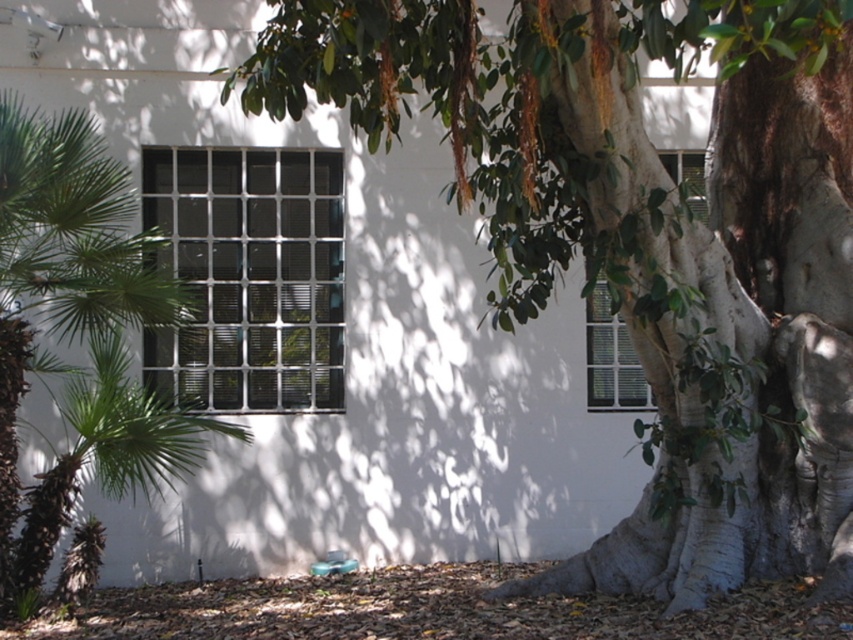
Is clear glass window at center wider than white grid glass window at right?

Correct, the width of clear glass window at center exceeds that of white grid glass window at right.

Between point (173, 209) and point (698, 163), which one is positioned in front?

Point (173, 209)

This screenshot has height=640, width=853. In order to click on clear glass window at center in this screenshot , I will do `click(248, 276)`.

Who is more distant from viewer, (750, 12) or (242, 285)?

Positioned behind is point (242, 285).

Is green leafy tree at center shorter than clear glass window at center?

Incorrect, green leafy tree at center's height does not fall short of clear glass window at center's.

Is point (537, 22) positioned before point (264, 301)?

Yes, it is in front of point (264, 301).

Where is `green leafy tree at center`? The height and width of the screenshot is (640, 853). green leafy tree at center is located at coordinates (643, 241).

Based on the photo, is green leafy tree at center to the left of white grid glass window at right from the viewer's perspective?

Yes, green leafy tree at center is to the left of white grid glass window at right.

Is point (326, 88) positioned before point (598, 368)?

That is True.

Identify the location of green leafy tree at center. (643, 241).